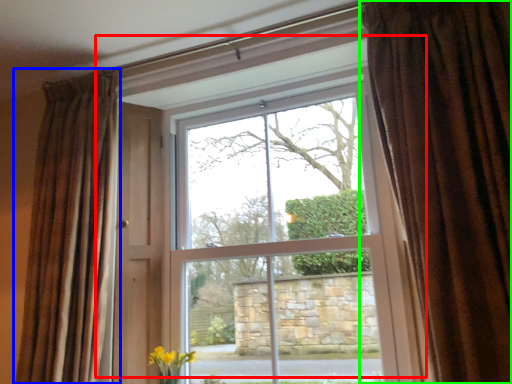
Question: Based on their relative distances, which object is nearer to window (highlighted by a red box)? Choose from curtain (highlighted by a blue box) and curtain (highlighted by a green box).

Choices:
 (A) curtain
 (B) curtain

Answer: (A)